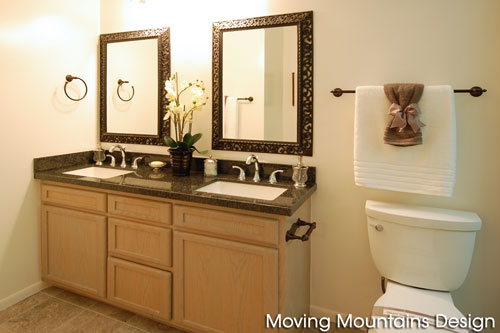
What are the coordinates of `beige walls` in the screenshot? It's located at (352, 52), (43, 62).